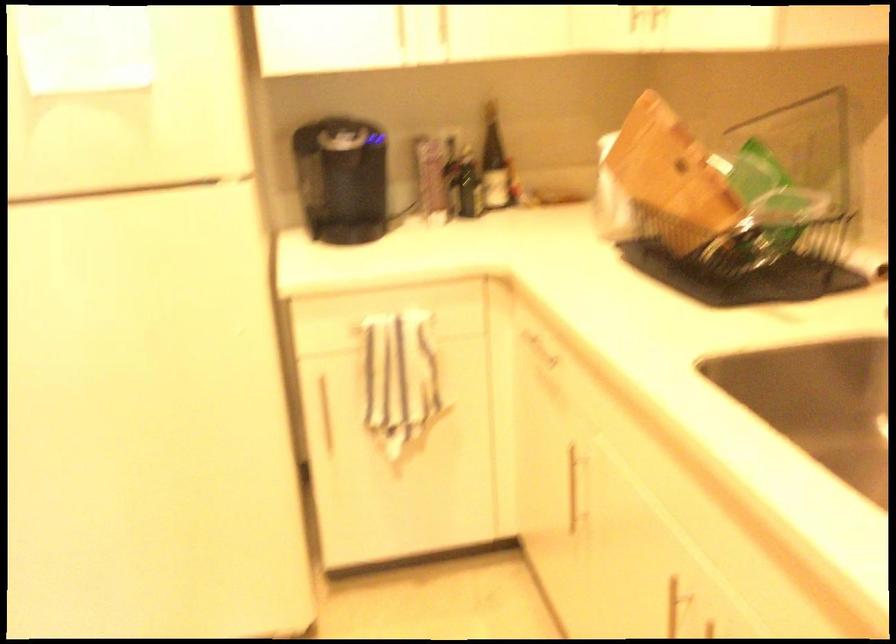
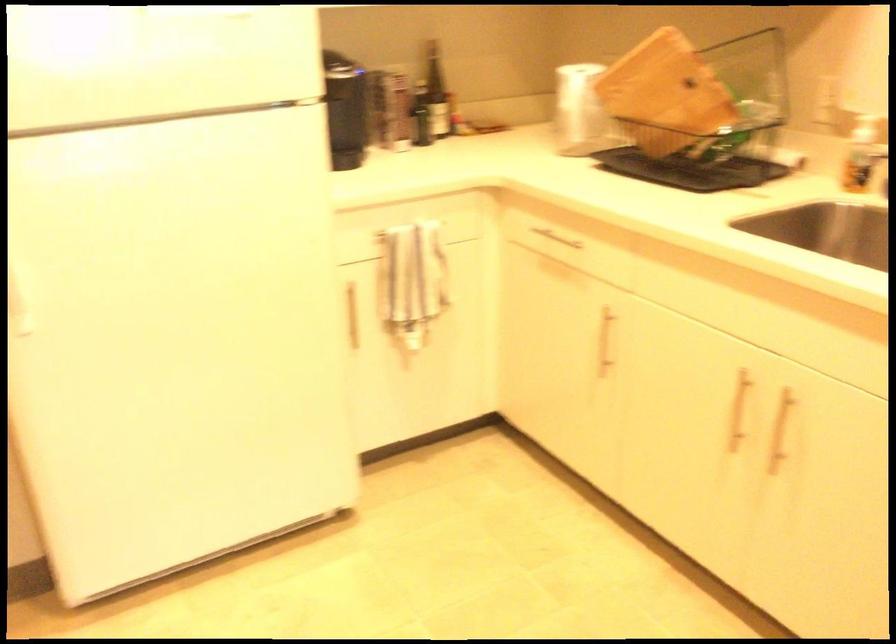
Where in the second image is the point corresponding to (x=582, y=491) from the first image?

(605, 341)